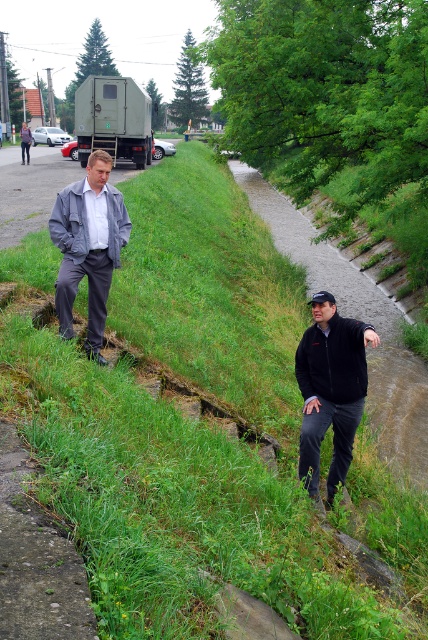
You are standing at the point with coordinates point (97,170) and want to walk towards the point with coordinates point (315,349). Based on the scene description, will you be moving towards the waterway or away from it?

Based on the scene description, the person on the right is gesturing towards the waterway. Since point (315,349) is behind point (97,170), moving towards it would mean moving away from the waterway.

You are a tailor who needs to determine which jacket requires more fabric for a new order. Based on the image, which jacket between the black fleece jacket at center and the gray matte jacket at left would need more fabric?

The gray matte jacket at left requires more fabric because it is wider than the black fleece jacket at center.